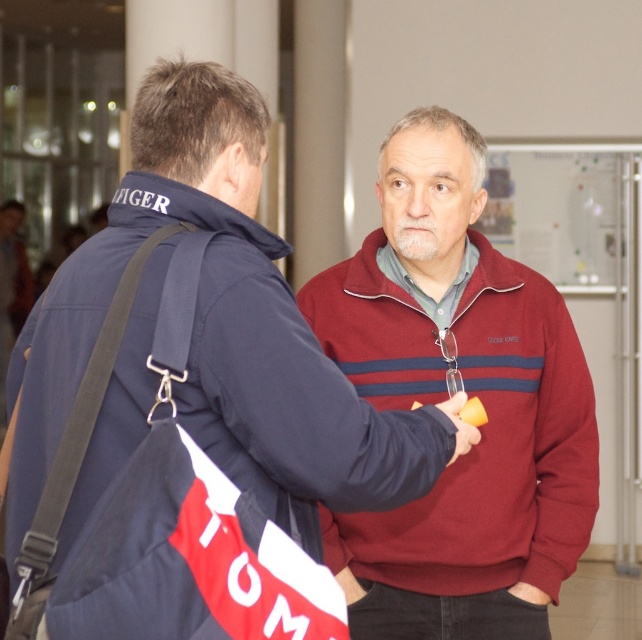
You are a security guard in the lobby and need to check the contents of both the burgundy fleece at center and the blue fabric bag at left. Which item should you inspect first based on their positions?

The blue fabric bag at left should be inspected first because the burgundy fleece at center is located below it, meaning the bag is higher up and more accessible.

You are organizing a clothing store and need to arrange the maroon sweater at center and the blue fabric bag at left based on their positions in the image. Which item should be placed to the right of the other?

The maroon sweater at center is positioned on the right side of blue fabric bag at left, so the maroon sweater at center should be placed to the right of the blue fabric bag at left.